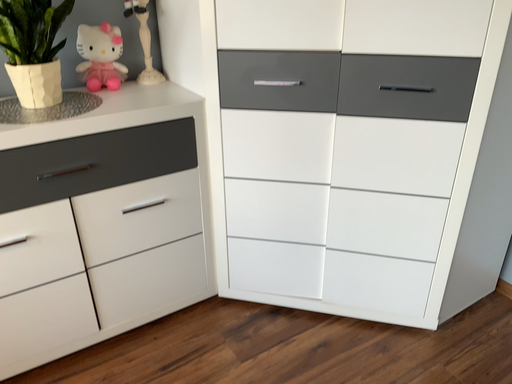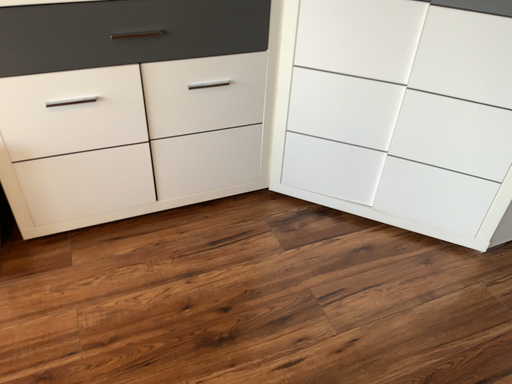
Question: Which way did the camera rotate in the video?

Choices:
 (A) rotated left
 (B) rotated right

Answer: (A)